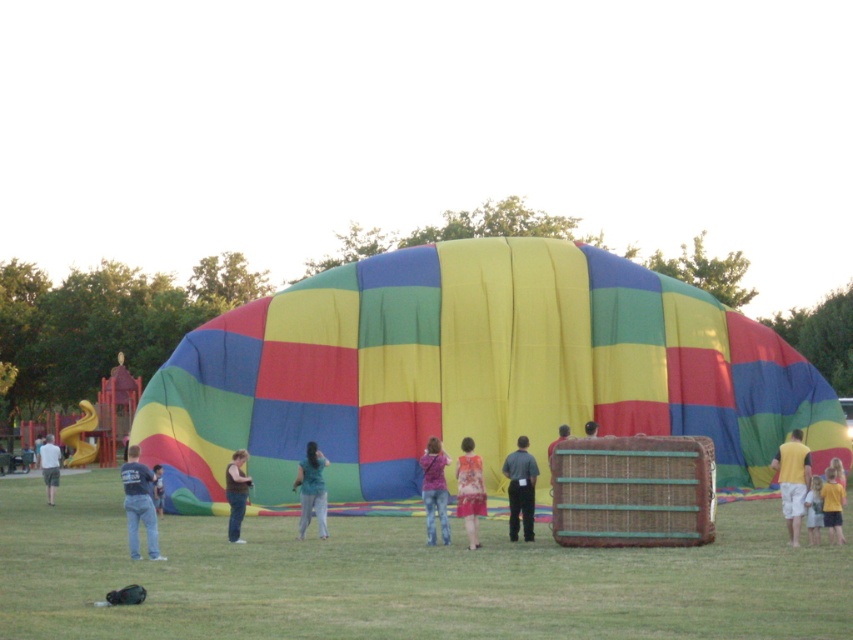
Can you confirm if yellow cotton shirt at right is positioned above floral dress at center?

Indeed, yellow cotton shirt at right is positioned over floral dress at center.

Is yellow cotton shirt at right wider than floral dress at center?

Correct, the width of yellow cotton shirt at right exceeds that of floral dress at center.

The width and height of the screenshot is (853, 640). Describe the element at coordinates (792, 481) in the screenshot. I see `yellow cotton shirt at right` at that location.

At what (x,y) coordinates should I click in order to perform the action: click on yellow cotton shirt at right. Please return your answer as a coordinate pair (x, y). The width and height of the screenshot is (853, 640). Looking at the image, I should click on (792, 481).

Which is more to the left, yellow cotton shirt at right or yellow t-shirt at lower right?

Positioned to the left is yellow t-shirt at lower right.

How much distance is there between yellow cotton shirt at right and yellow t-shirt at lower right?

The distance of yellow cotton shirt at right from yellow t-shirt at lower right is 9.14 feet.

Describe the element at coordinates (792, 481) in the screenshot. I see `yellow cotton shirt at right` at that location.

Where is `yellow cotton shirt at right`? The image size is (853, 640). yellow cotton shirt at right is located at coordinates (792, 481).

Who is more distant from viewer, (560, 385) or (833, 524)?

The point (560, 385) is more distant.

Can you confirm if multicolored fabric balloon at center is positioned above yellow t-shirt at lower right?

Correct, multicolored fabric balloon at center is located above yellow t-shirt at lower right.

Which is in front, point (500, 492) or point (834, 496)?

Point (834, 496) is more forward.

Where is `multicolored fabric balloon at center`? multicolored fabric balloon at center is located at coordinates (473, 372).